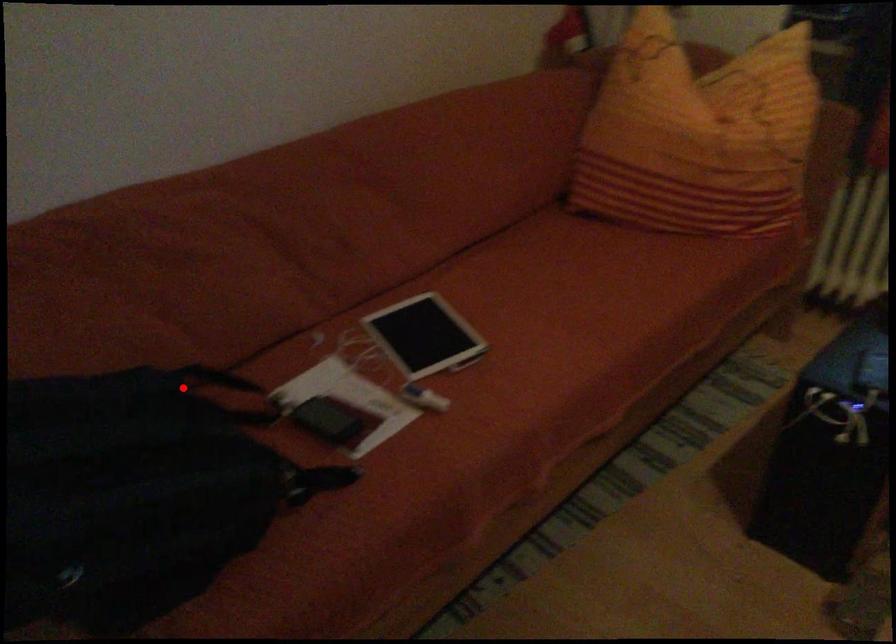
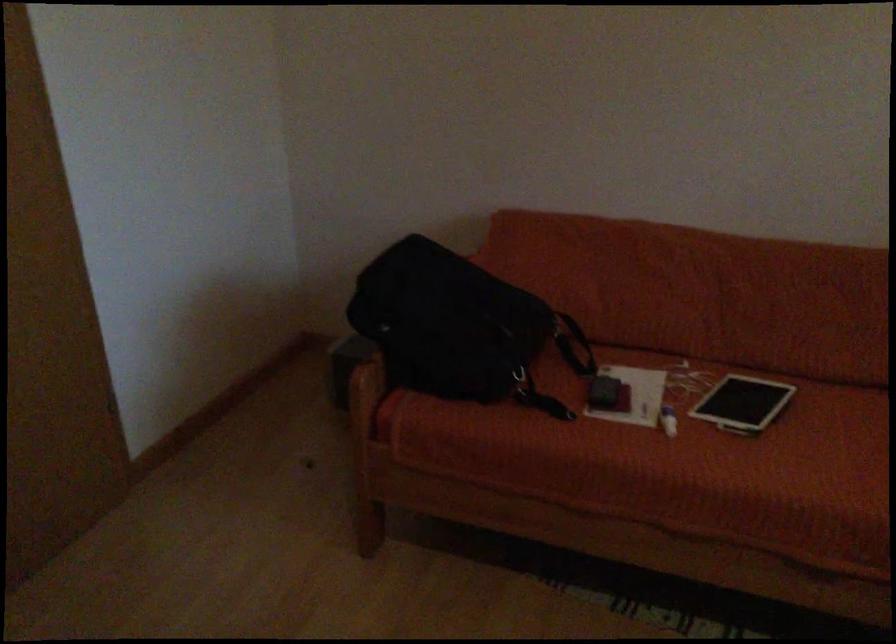
Question: I am providing you with two images of the same scene from different viewpoints. Given a red point in image1, look at the same physical point in image2. Is it:

Choices:
 (A) Closer to the viewpoint
 (B) Farther from the viewpoint

Answer: (B)